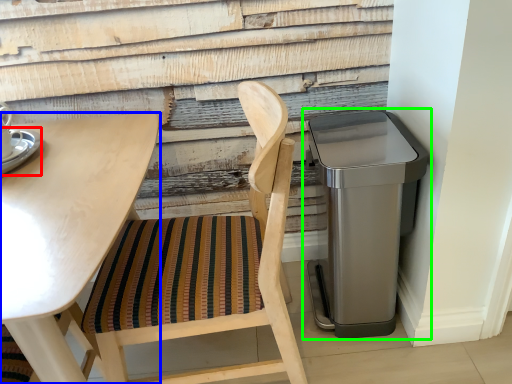
Question: Which object is positioned closest to saucer (highlighted by a red box)? Select from table (highlighted by a blue box) and waste container (highlighted by a green box).

Choices:
 (A) table
 (B) waste container

Answer: (A)